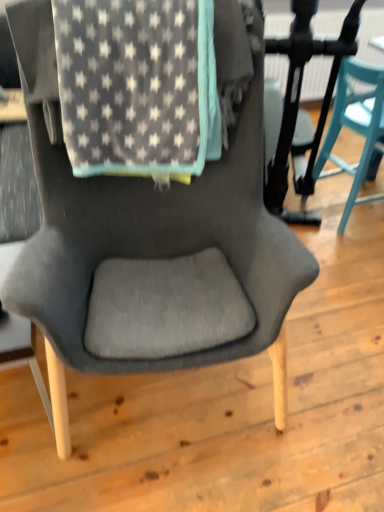
Question: Should I look upward or downward to see teal plastic chair at right?

Choices:
 (A) down
 (B) up

Answer: (B)

Question: Should I look upward or downward to see gray star-patterned blanket at upper center?

Choices:
 (A) down
 (B) up

Answer: (B)

Question: Is teal plastic chair at right positioned beyond the bounds of gray star-patterned blanket at upper center?

Choices:
 (A) yes
 (B) no

Answer: (A)

Question: Does teal plastic chair at right come behind gray star-patterned blanket at upper center?

Choices:
 (A) yes
 (B) no

Answer: (A)

Question: From a real-world perspective, is teal plastic chair at right on top of gray star-patterned blanket at upper center?

Choices:
 (A) no
 (B) yes

Answer: (A)

Question: Does teal plastic chair at right have a lesser width compared to gray star-patterned blanket at upper center?

Choices:
 (A) yes
 (B) no

Answer: (A)

Question: Can you confirm if teal plastic chair at right is shorter than gray star-patterned blanket at upper center?

Choices:
 (A) no
 (B) yes

Answer: (A)

Question: Is teal plastic chair at right in contact with gray star-patterned blanket at upper center?

Choices:
 (A) yes
 (B) no

Answer: (B)

Question: Does gray star-patterned blanket at upper center appear on the left side of teal plastic chair at right?

Choices:
 (A) no
 (B) yes

Answer: (B)

Question: Can you confirm if gray star-patterned blanket at upper center is bigger than teal plastic chair at right?

Choices:
 (A) no
 (B) yes

Answer: (A)

Question: Can you confirm if gray star-patterned blanket at upper center is thinner than teal plastic chair at right?

Choices:
 (A) no
 (B) yes

Answer: (A)

Question: From the image's perspective, does gray star-patterned blanket at upper center appear higher than teal plastic chair at right?

Choices:
 (A) yes
 (B) no

Answer: (B)

Question: Is gray star-patterned blanket at upper center to the right of teal plastic chair at right from the viewer's perspective?

Choices:
 (A) no
 (B) yes

Answer: (A)

Question: From a real-world perspective, is gray star-patterned blanket at upper center on top of teal plastic chair at right?

Choices:
 (A) yes
 (B) no

Answer: (A)

Question: Is gray star-patterned blanket at upper center spatially inside teal plastic chair at right, or outside of it?

Choices:
 (A) inside
 (B) outside

Answer: (B)